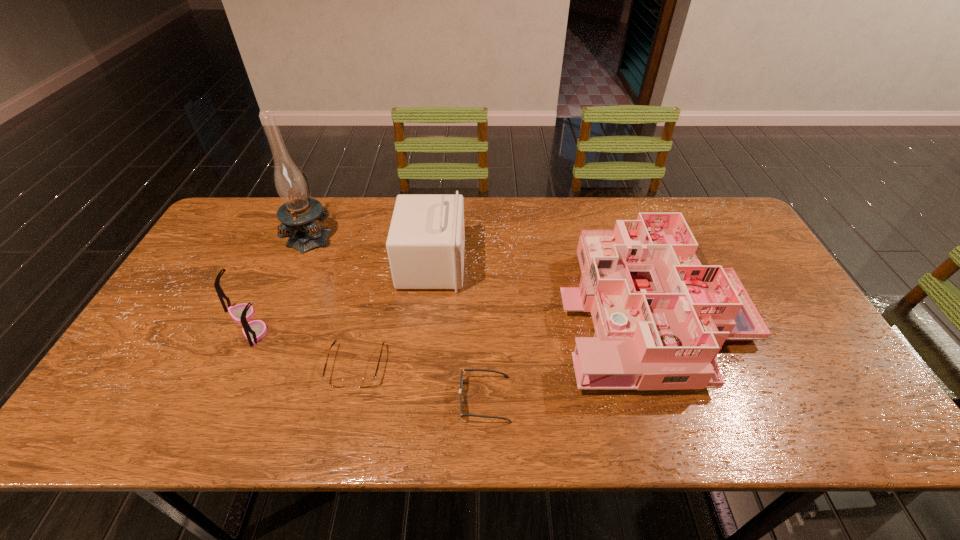
Where is `vacant space at the far edge`? vacant space at the far edge is located at coordinates (578, 240).

Where is `vacant area at the near edge`? The width and height of the screenshot is (960, 540). vacant area at the near edge is located at coordinates (736, 434).

In the image, there is a desktop. Where is `free space at the left edge`? This screenshot has width=960, height=540. free space at the left edge is located at coordinates (122, 387).

The height and width of the screenshot is (540, 960). In order to click on vacant space at the right edge of the desktop in this screenshot , I will do `click(773, 278)`.

This screenshot has width=960, height=540. In order to click on free region at the far left corner in this screenshot , I will do `click(249, 218)`.

In the image, there is a desktop. At what (x,y) coordinates should I click in order to perform the action: click on vacant space at the far right corner. Please return your answer as a coordinate pair (x, y). This screenshot has width=960, height=540. Looking at the image, I should click on (708, 214).

You are a GUI agent. You are given a task and a screenshot of the screen. Output one action in this format:
    pyautogui.click(x=<x>, y=<y>)
    Task: Click on the vacant region between the tallest object and the second spectacles from left to right
    
    Given the screenshot: What is the action you would take?
    pyautogui.click(x=334, y=300)

I want to click on free space between the tallest object and the second object from right to left, so click(397, 317).

Locate an element on the screen. vacant space that is in between the tallest spectacles and the second spectacles from left to right is located at coordinates (302, 345).

Where is `empty location between the dollhouse and the tallest object`? This screenshot has width=960, height=540. empty location between the dollhouse and the tallest object is located at coordinates (481, 271).